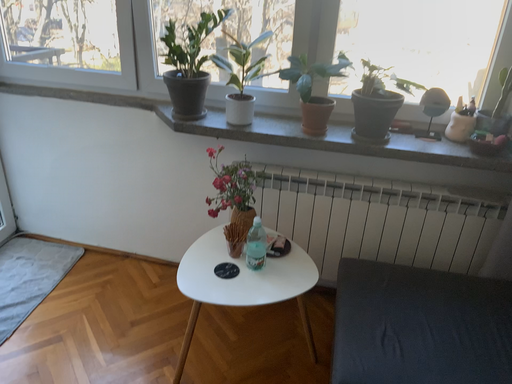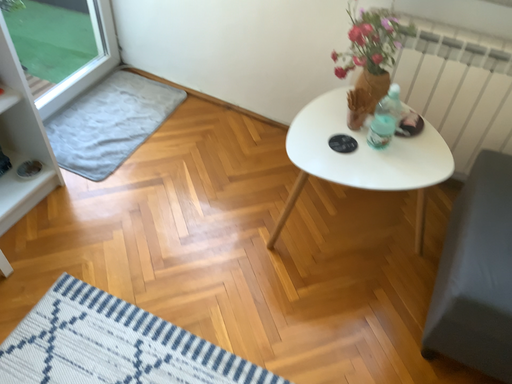
Question: How did the camera likely rotate when shooting the video?

Choices:
 (A) rotated downward
 (B) rotated upward

Answer: (A)